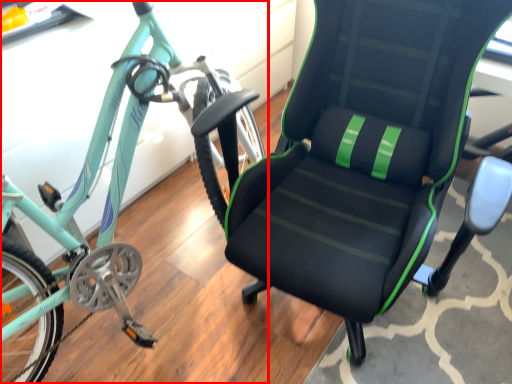
Question: From the image's perspective, where is bicycle (annotated by the red box) located relative to chair?

Choices:
 (A) below
 (B) above

Answer: (B)